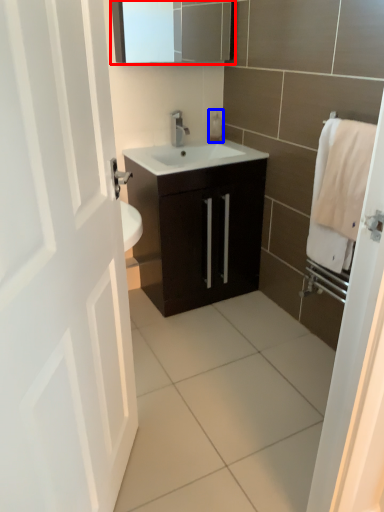
Question: Which object appears closest to the camera in this image, medicine cabinet (highlighted by a red box) or soap dispenser (highlighted by a blue box)?

Choices:
 (A) medicine cabinet
 (B) soap dispenser

Answer: (A)